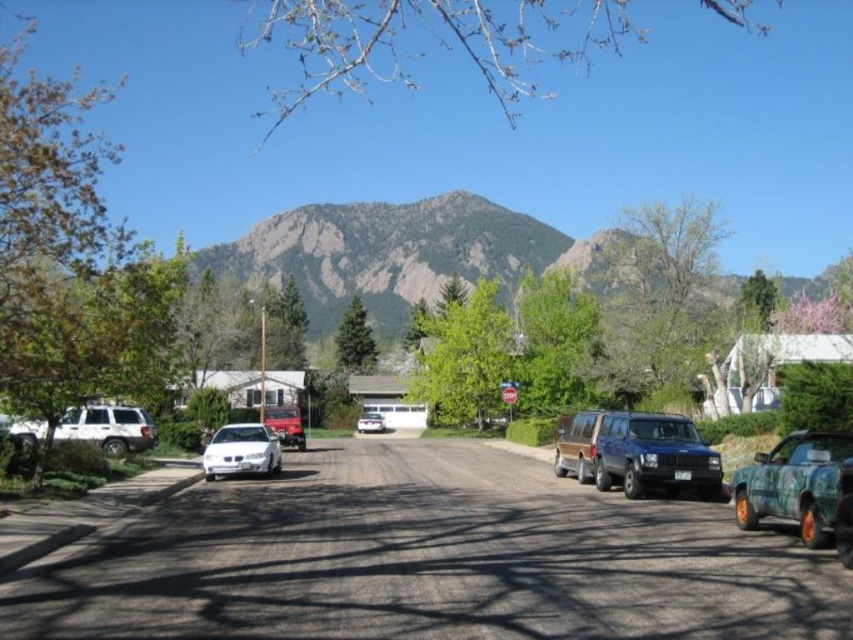
Between point (775, 499) and point (374, 433), which one is positioned behind?

Positioned behind is point (374, 433).

Is camouflage paint truck at lower right smaller than white matte sedan at center?

Actually, camouflage paint truck at lower right might be larger than white matte sedan at center.

Who is more forward, (x=784, y=467) or (x=357, y=420)?

Positioned in front is point (x=784, y=467).

I want to click on camouflage paint truck at lower right, so click(793, 483).

Is matte blue suv at center above white matte suv at left?

Actually, matte blue suv at center is below white matte suv at left.

Where is `matte blue suv at center`? This screenshot has height=640, width=853. matte blue suv at center is located at coordinates (639, 452).

Can you confirm if camouflage paint truck at lower right is positioned to the right of white matte suv at left?

Yes, camouflage paint truck at lower right is to the right of white matte suv at left.

Can you confirm if camouflage paint truck at lower right is taller than white matte suv at left?

No, camouflage paint truck at lower right is not taller than white matte suv at left.

The width and height of the screenshot is (853, 640). I want to click on camouflage paint truck at lower right, so click(x=793, y=483).

Locate an element on the screen. This screenshot has width=853, height=640. camouflage paint truck at lower right is located at coordinates (793, 483).